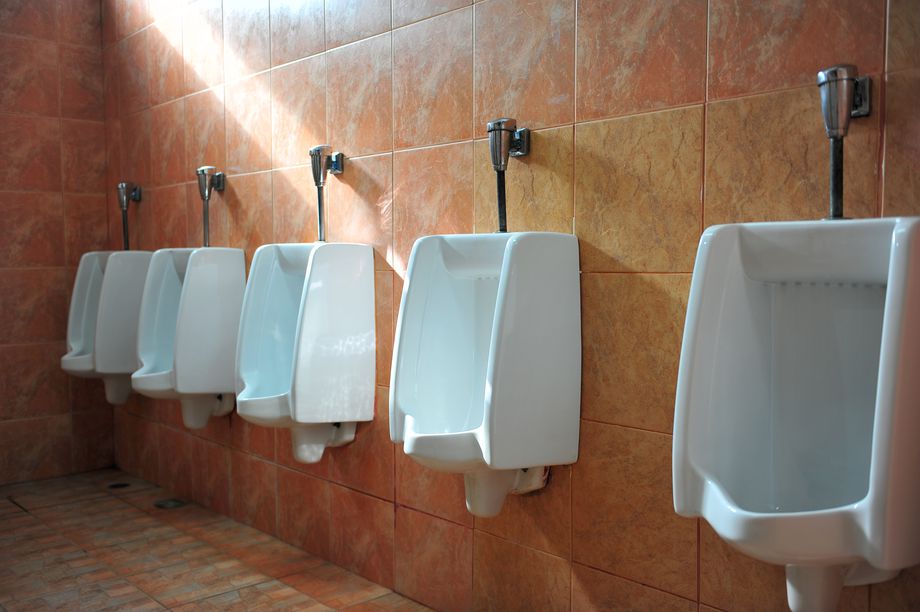
At what (x,y) coordinates should I click in order to perform the action: click on bathroom urinals. Please return your answer as a coordinate pair (x, y). Looking at the image, I should click on (109, 307), (162, 307), (281, 326), (453, 349), (782, 394).